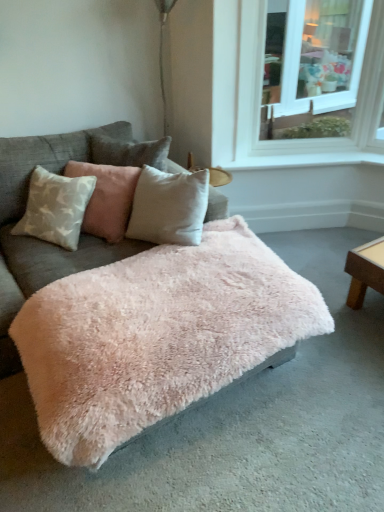
Question: From a real-world perspective, relative to fuzzy pink blanket at center, is white smooth window sill at upper right vertically above or below?

Choices:
 (A) below
 (B) above

Answer: (B)

Question: Does point (317, 153) appear closer or farther from the camera than point (14, 157)?

Choices:
 (A) closer
 (B) farther

Answer: (B)

Question: Estimate the real-world distances between objects in this image. Which object is farther from the white smooth window sill at upper right?

Choices:
 (A) white glass window at upper right
 (B) velvet beige pillow at center
 (C) fuzzy pink blanket at center
 (D) fuzzy pink ottoman at center

Answer: (D)

Question: Which object is the closest to the fuzzy pink blanket at center?

Choices:
 (A) velvet beige pillow at center
 (B) white smooth window sill at upper right
 (C) white glass window at upper right
 (D) fuzzy pink ottoman at center

Answer: (D)